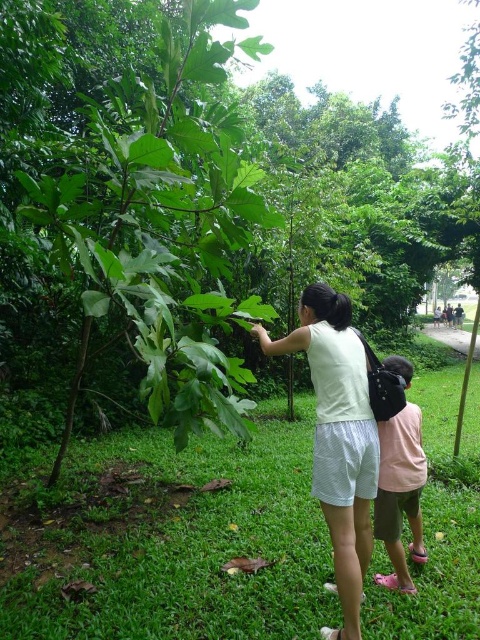
Question: Is green grass at lower center below green leafy tree at center?

Choices:
 (A) no
 (B) yes

Answer: (B)

Question: Which of the following is the farthest from the observer?

Choices:
 (A) (156, 314)
 (B) (418, 467)

Answer: (B)

Question: Does green grass at lower center lie behind pink fabric shirt at center?

Choices:
 (A) no
 (B) yes

Answer: (A)

Question: Which of the following is the farthest from the observer?

Choices:
 (A) white cotton shirt at center
 (B) pink fabric shirt at center

Answer: (B)

Question: Which of the following is the closest to the observer?

Choices:
 (A) green leafy tree at center
 (B) white cotton shirt at center
 (C) green grass at lower center
 (D) pink fabric shirt at center

Answer: (B)

Question: Does green leafy tree at center have a lesser width compared to white cotton shirt at center?

Choices:
 (A) yes
 (B) no

Answer: (B)